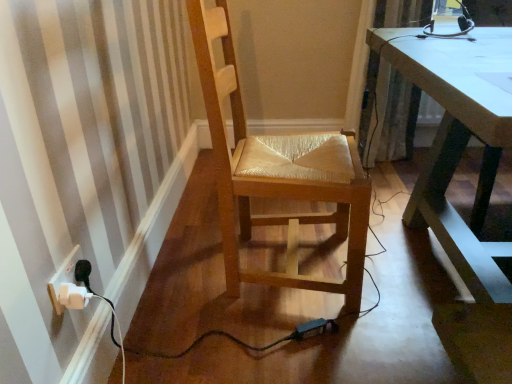
Question: Is the depth of textured beige curtain at upper right less than that of white plastic plug at lower left?

Choices:
 (A) yes
 (B) no

Answer: (B)

Question: Is textured beige curtain at upper right further to camera compared to white plastic plug at lower left?

Choices:
 (A) yes
 (B) no

Answer: (A)

Question: Considering the relative sizes of textured beige curtain at upper right and white plastic plug at lower left in the image provided, is textured beige curtain at upper right taller than white plastic plug at lower left?

Choices:
 (A) no
 (B) yes

Answer: (B)

Question: Can you confirm if textured beige curtain at upper right is smaller than white plastic plug at lower left?

Choices:
 (A) yes
 (B) no

Answer: (B)

Question: Are textured beige curtain at upper right and white plastic plug at lower left beside each other?

Choices:
 (A) yes
 (B) no

Answer: (B)

Question: Is textured beige curtain at upper right bigger than white plastic plug at lower left?

Choices:
 (A) no
 (B) yes

Answer: (B)

Question: From the image's perspective, is white plastic plug at lower left over wooden woven seat at center?

Choices:
 (A) yes
 (B) no

Answer: (B)

Question: From the image's perspective, does white plastic plug at lower left appear lower than wooden woven seat at center?

Choices:
 (A) no
 (B) yes

Answer: (B)

Question: Is white plastic plug at lower left touching wooden woven seat at center?

Choices:
 (A) no
 (B) yes

Answer: (A)

Question: Is white plastic plug at lower left thinner than wooden woven seat at center?

Choices:
 (A) no
 (B) yes

Answer: (B)

Question: Is white plastic plug at lower left closer to camera compared to wooden woven seat at center?

Choices:
 (A) yes
 (B) no

Answer: (A)

Question: Would you say wooden woven seat at center is part of white plastic plug at lower left's contents?

Choices:
 (A) yes
 (B) no

Answer: (B)

Question: Is wooden woven seat at center turned away from textured beige curtain at upper right?

Choices:
 (A) no
 (B) yes

Answer: (A)